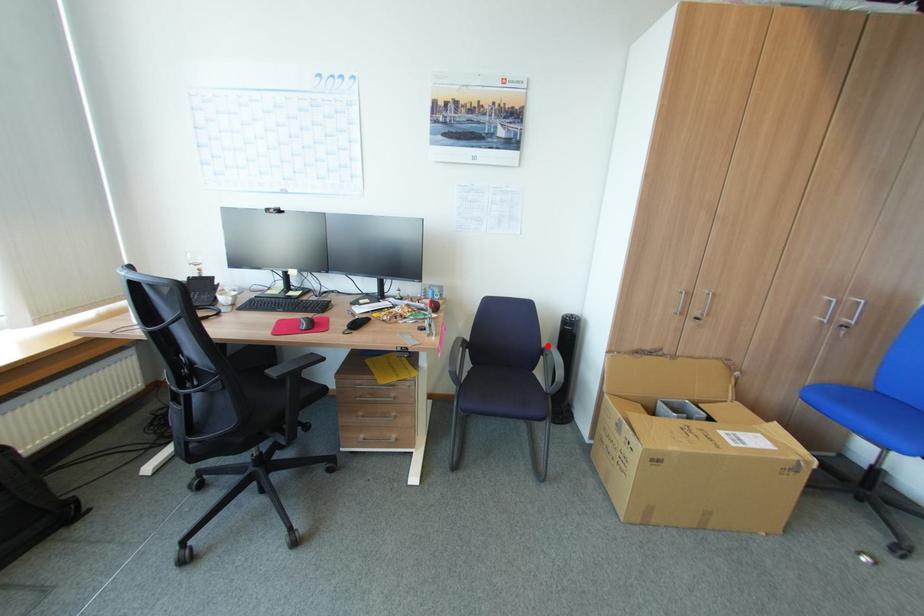
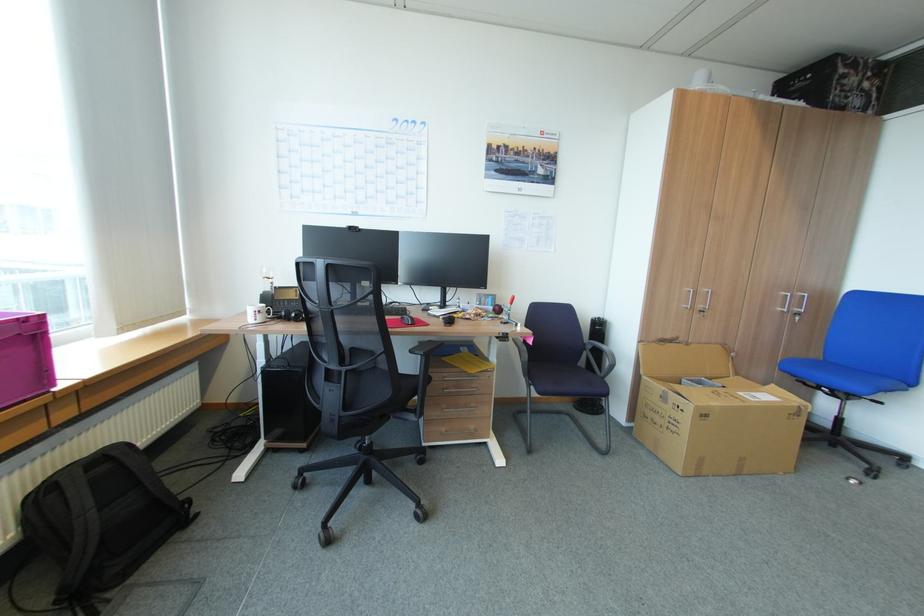
In the second image, find the point that corresponds to the highlighted location in the first image.

(590, 342)